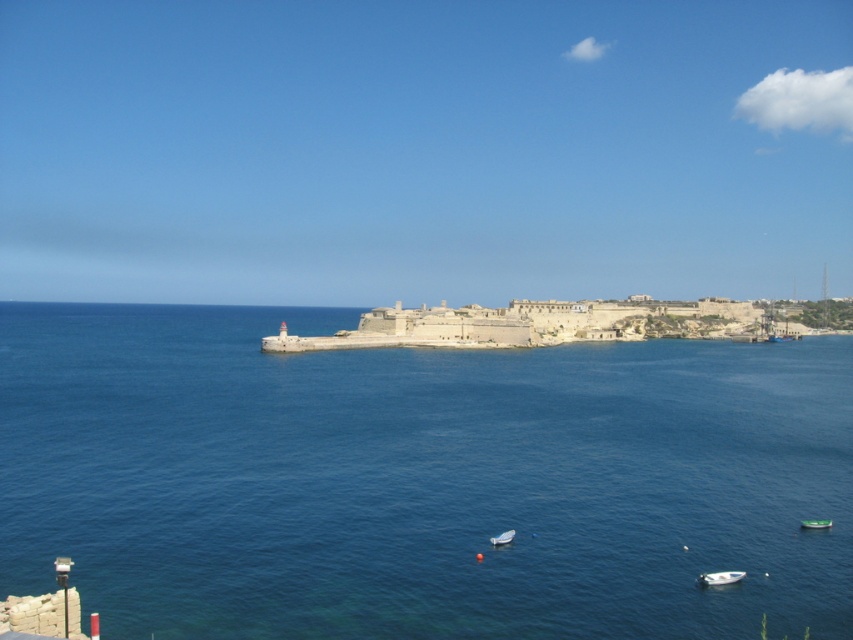
Which of these two, blue water at center or white plastic boat at lower center, stands taller?

With more height is blue water at center.

The height and width of the screenshot is (640, 853). Find the location of `blue water at center`. blue water at center is located at coordinates (418, 481).

The image size is (853, 640). Find the location of `blue water at center`. blue water at center is located at coordinates 418,481.

Can you confirm if white plastic boat at lower right is thinner than green plastic boat at lower right?

Incorrect, white plastic boat at lower right's width is not less than green plastic boat at lower right's.

Is white plastic boat at lower right further to camera compared to green plastic boat at lower right?

That is False.

Is point (709, 573) positioned in front of point (830, 524)?

Yes, it is in front of point (830, 524).

Where is `white plastic boat at lower right`? This screenshot has width=853, height=640. white plastic boat at lower right is located at coordinates (720, 577).

Can you confirm if green plastic boat at lower right is bigger than white plastic boat at lower center?

Actually, green plastic boat at lower right might be smaller than white plastic boat at lower center.

How distant is green plastic boat at lower right from white plastic boat at lower center?

16.84 meters

Describe the element at coordinates (815, 524) in the screenshot. I see `green plastic boat at lower right` at that location.

Where is `green plastic boat at lower right`? This screenshot has width=853, height=640. green plastic boat at lower right is located at coordinates (815, 524).